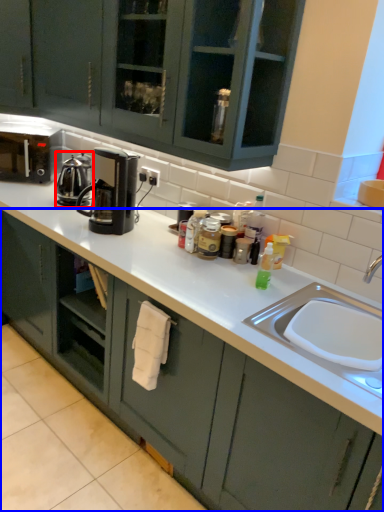
Question: Which object appears farthest to the camera in this image, kitchen appliance (highlighted by a red box) or cabinetry (highlighted by a blue box)?

Choices:
 (A) kitchen appliance
 (B) cabinetry

Answer: (A)